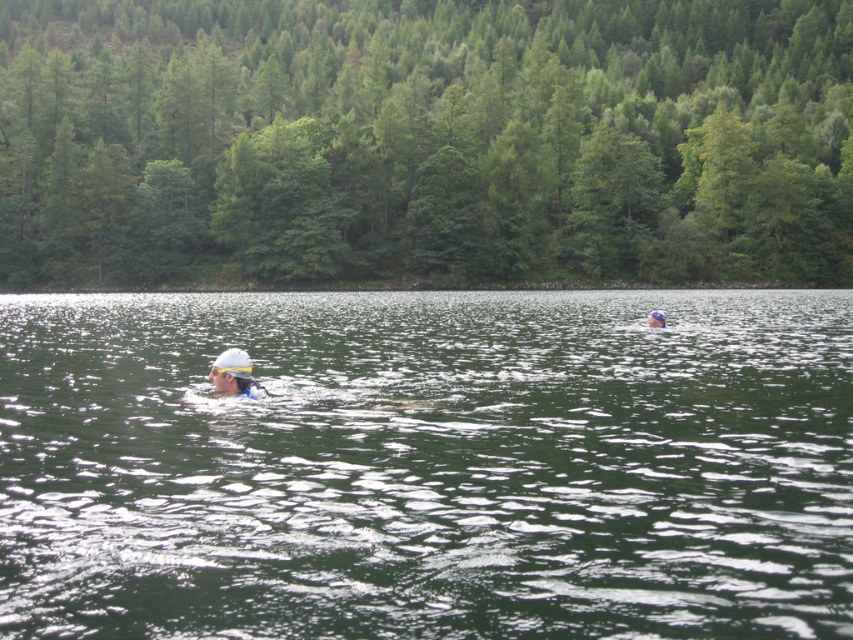
You are a photographer trying to capture a closeup shot of the white matte swim cap at center while ensuring the green liquid water at center is also visible in the frame. Given their sizes, which object should you focus on to include both in the composition?

The green liquid water at center is bigger than the white matte swim cap at center, so focusing on the larger water area will naturally include the smaller swim cap within the frame.

You are a photographer trying to capture a clear shot of the white matte swim cap at center. However, the green liquid water at center is blocking your view. Can you adjust your position to see the swim cap clearly?

The green liquid water at center is in front of the white matte swim cap at center, so moving your position to angle around the water or adjusting your camera angle to look past the water would allow you to see the swim cap clearly.